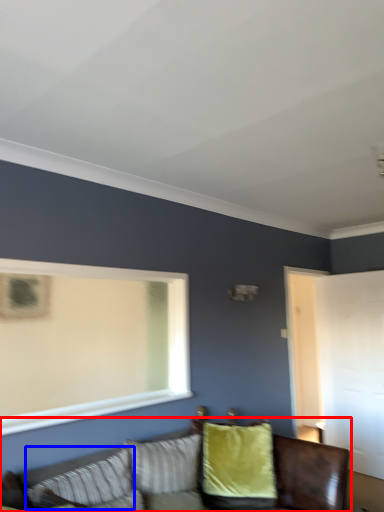
Question: Which of the following is the farthest to the observer, studio couch (highlighted by a red box) or pillow (highlighted by a blue box)?

Choices:
 (A) studio couch
 (B) pillow

Answer: (B)